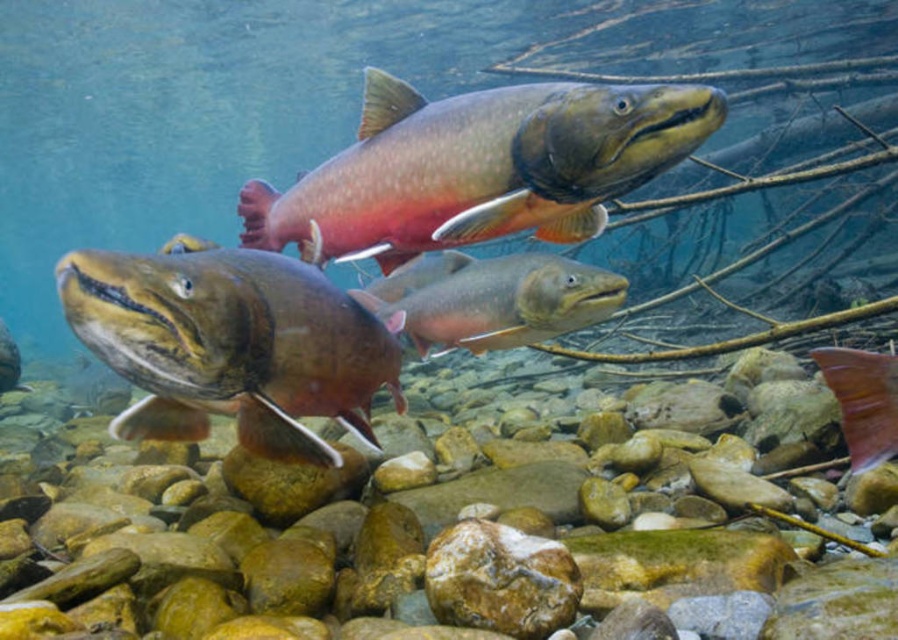
You are a scuba diver with a 5.5 feet long net. You see two points in the water at coordinates point (385, 589). Can you catch both points with your net in one go?

The two points are 6.45 feet apart, which is longer than your net length of 5.5 feet. Therefore, you cannot catch both points with your net in one go.

You are a scuba diver observing the underwater scene. You see the smooth rock at center and the shiny orange fish at lower right. Which object is positioned to the right side of the other?

The shiny orange fish at lower right is to the right of the smooth rock at center.

You are a marine biologist observing the underwater scene. You need to determine which fish is wider between the shiny brown fish at center and the shiny orange fish at lower right. Based on your observation, which one is wider?

The shiny brown fish at center is wider than the shiny orange fish at lower right according to the description.